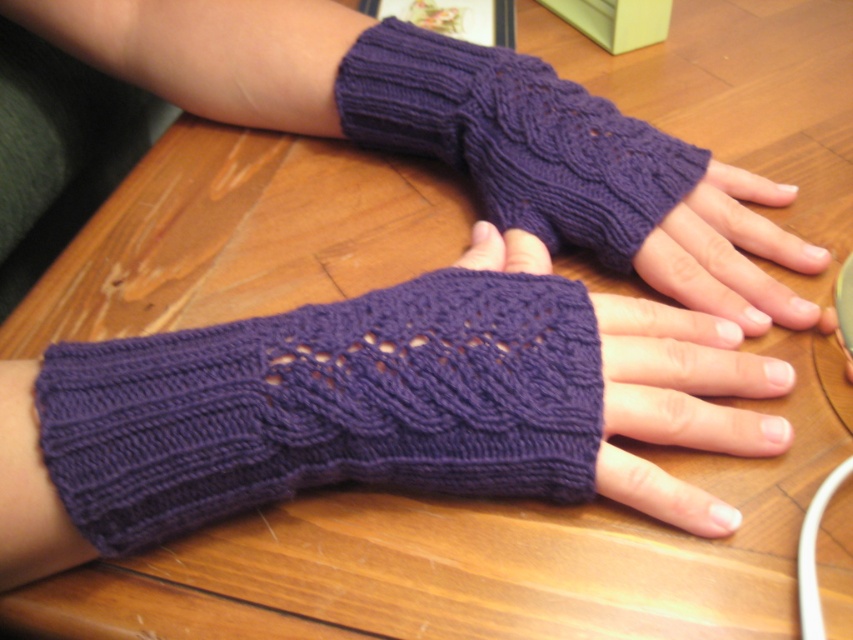
Does point (761, 452) lie behind point (738, 308)?

No, it is not.

Measure the distance between purple knitted fingerless glove at center and camera.

purple knitted fingerless glove at center is 11.99 inches away from camera.

Who is more distant from viewer, (534, 387) or (757, 225)?

Positioned behind is point (757, 225).

I want to click on purple knitted fingerless glove at center, so click(402, 403).

Consider the image. Can you confirm if purple knitted fingerless gloves at center is shorter than matte purple fingerless gloves at center?

Incorrect, purple knitted fingerless gloves at center's height does not fall short of matte purple fingerless gloves at center's.

Measure the distance from purple knitted fingerless gloves at center to matte purple fingerless gloves at center.

purple knitted fingerless gloves at center and matte purple fingerless gloves at center are 8.69 centimeters apart from each other.

Where is `purple knitted fingerless gloves at center`? Image resolution: width=853 pixels, height=640 pixels. purple knitted fingerless gloves at center is located at coordinates (515, 138).

Who is higher up, purple knitted fingerless glove at center or purple knitted fingerless gloves at center?

purple knitted fingerless gloves at center is higher up.

Who is more distant from viewer, (460, 275) or (497, 92)?

The point (497, 92) is behind.

In order to click on purple knitted fingerless glove at center in this screenshot , I will do `click(402, 403)`.